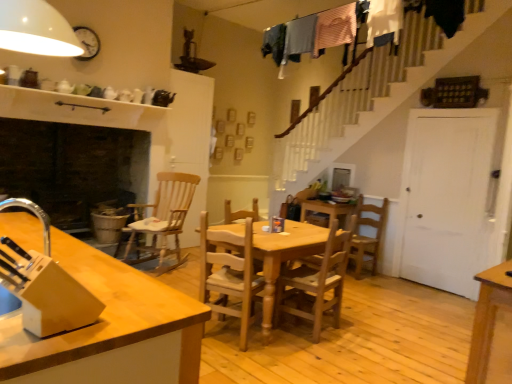
Image resolution: width=512 pixels, height=384 pixels. I want to click on vacant point to the right of wooden chair at center, the 3th chair positioned from the back, so tap(361, 336).